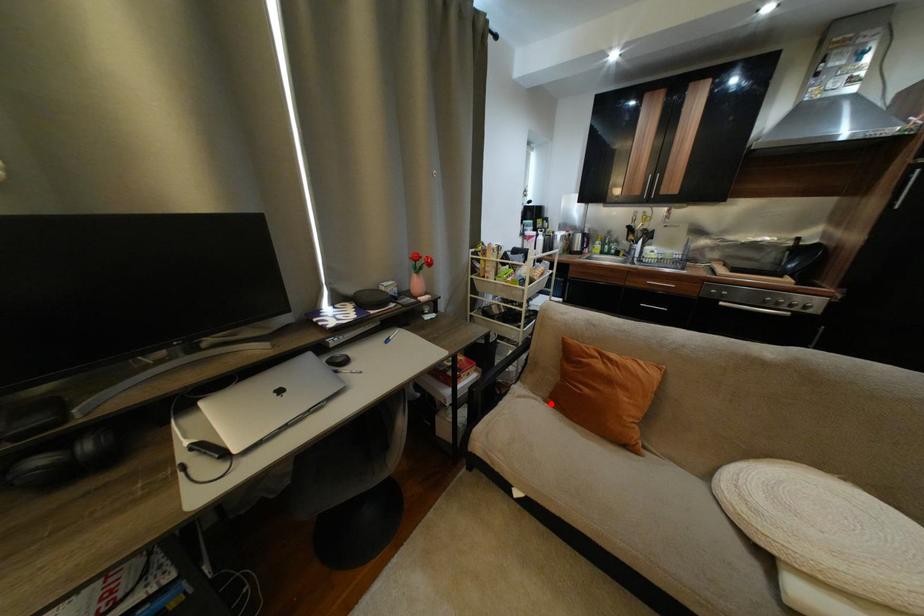
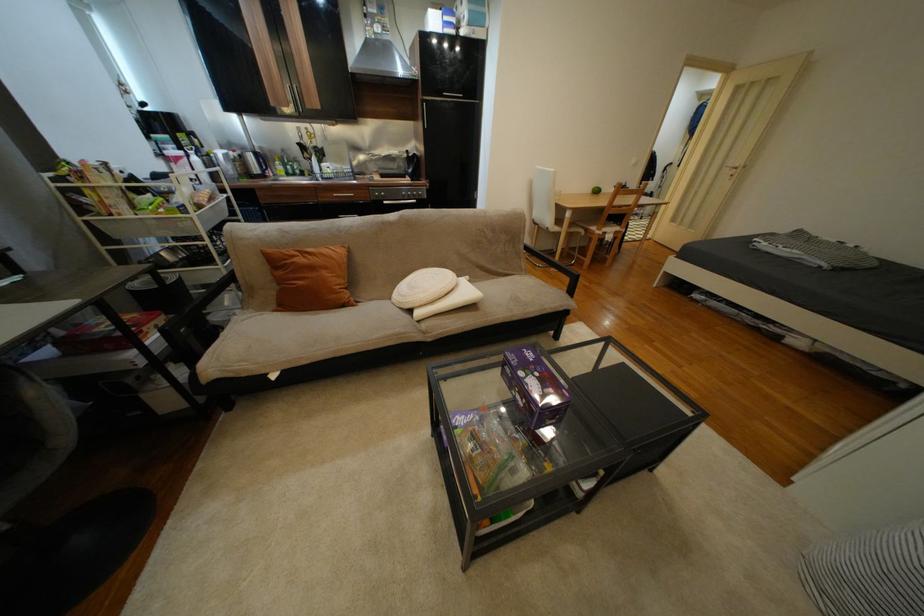
Locate, in the second image, the point that corresponds to the highlighted location in the first image.

(280, 314)